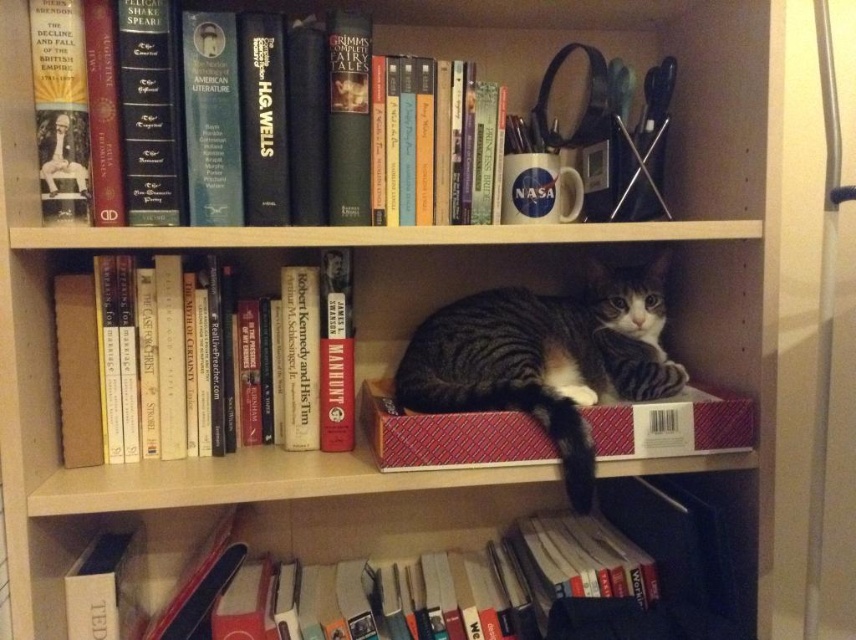
Can you confirm if hardcover book at center is wider than red textured box at center?

Incorrect, hardcover book at center's width does not surpass red textured box at center's.

Who is more distant from viewer, (180, 436) or (749, 436)?

Positioned behind is point (180, 436).

I want to click on hardcover book at center, so click(x=316, y=356).

Between striped fur cat at center and red textured box at center, which one is positioned lower?

red textured box at center

Does striped fur cat at center appear under red textured box at center?

Actually, striped fur cat at center is above red textured box at center.

Is point (609, 392) closer to viewer compared to point (545, 449)?

No, it is not.

Where is `striped fur cat at center`? The width and height of the screenshot is (856, 640). striped fur cat at center is located at coordinates (545, 358).

Which is below, striped fur cat at center or hardcover book at lower center?

hardcover book at lower center is lower down.

Who is more forward, (x=580, y=321) or (x=575, y=618)?

Point (x=575, y=618) is in front.

What do you see at coordinates (545, 358) in the screenshot? This screenshot has height=640, width=856. I see `striped fur cat at center` at bounding box center [545, 358].

Identify the location of striped fur cat at center. (545, 358).